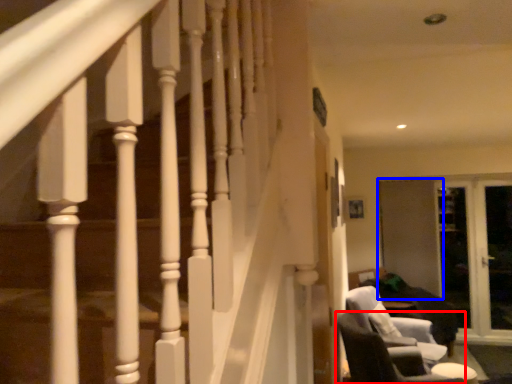
Question: Which point is closer to the camera, chair (highlighted by a red box) or screen door (highlighted by a blue box)?

Choices:
 (A) chair
 (B) screen door

Answer: (A)